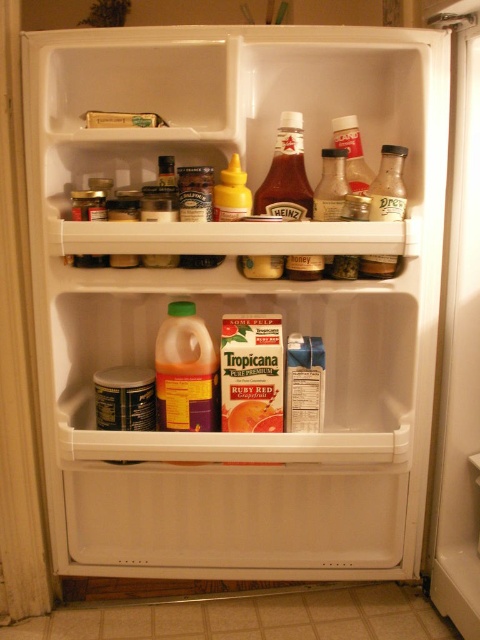
Question: Which object is closer to the camera taking this photo?

Choices:
 (A) yellow matte mustard at upper center
 (B) translucent plastic bottle at upper center
 (C) white plastic door at right

Answer: (C)

Question: Observing the image, what is the correct spatial positioning of yellow matte mustard at upper center in reference to translucent glass jar at upper center?

Choices:
 (A) right
 (B) left

Answer: (B)

Question: Estimate the real-world distances between objects in this image. Which object is farther from the translucent glass bottle at upper right?

Choices:
 (A) white plastic door at right
 (B) translucent glass jar at upper center
 (C) translucent plastic bottle at upper center

Answer: (A)

Question: Is translucent glass bottle at upper right above yellow matte mustard at upper center?

Choices:
 (A) yes
 (B) no

Answer: (B)

Question: Based on their relative distances, which object is farther from the yellow matte mustard at upper center?

Choices:
 (A) translucent glass bottle at upper right
 (B) white plastic door at right
 (C) smooth glass bottle of heinz ketchup at center

Answer: (B)

Question: Is translucent plastic bottle at upper center closer to the viewer compared to yellow matte mustard at upper center?

Choices:
 (A) no
 (B) yes

Answer: (A)